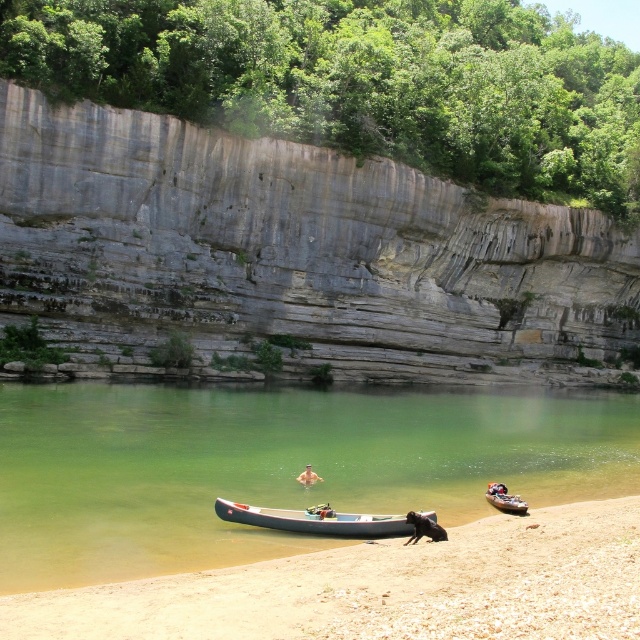
You are planning to launch a small wooden canoe at lower right into the green translucent water at lower center. Based on the scene, do you think the water is wide enough to accommodate the canoe?

The green translucent water at lower center might be wider than wooden canoe at lower right, so it is possible that the water is wide enough to accommodate the canoe.